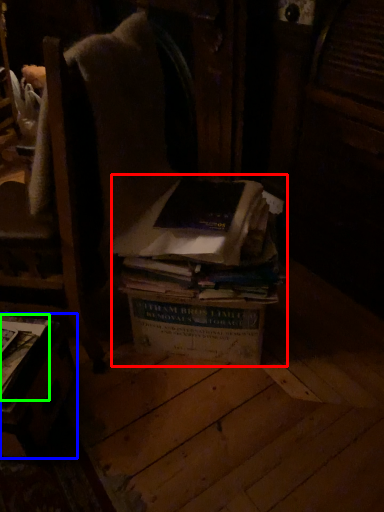
Question: Estimate the real-world distances between objects in this image. Which object is closer to book (highlighted by a red box), table (highlighted by a blue box) or book (highlighted by a green box)?

Choices:
 (A) table
 (B) book

Answer: (A)